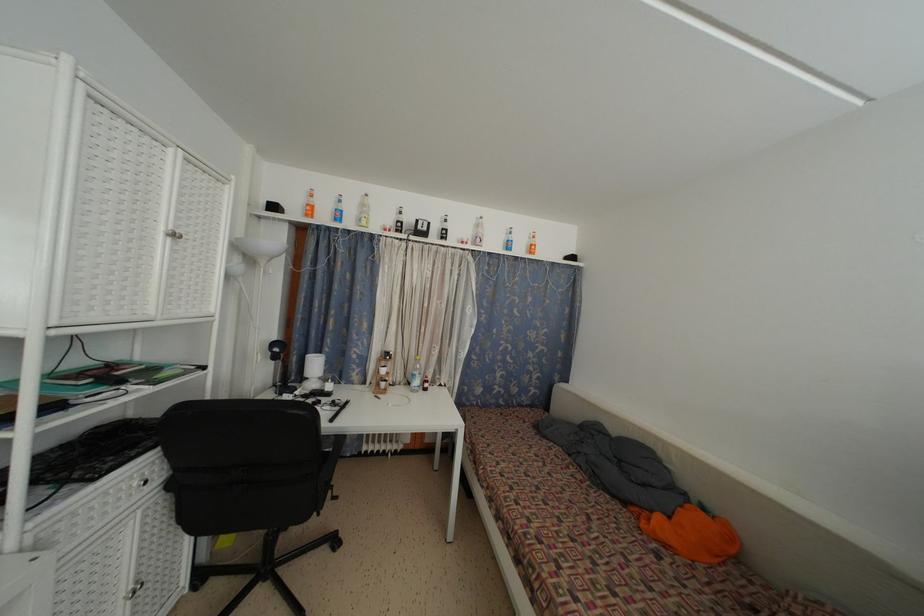
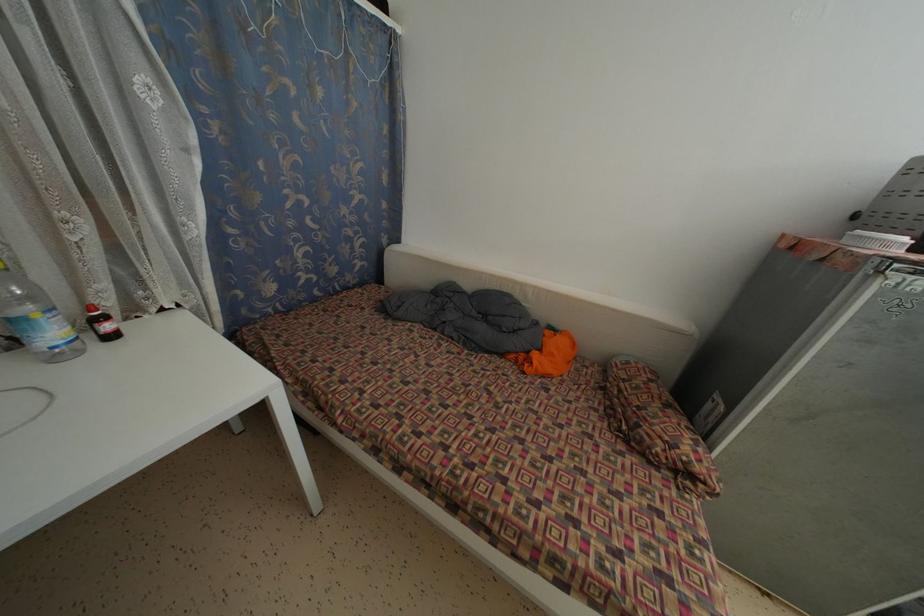
The first image is from the beginning of the video and the second image is from the end. How did the camera likely rotate when shooting the video?

The rotation direction of the camera is right-down.